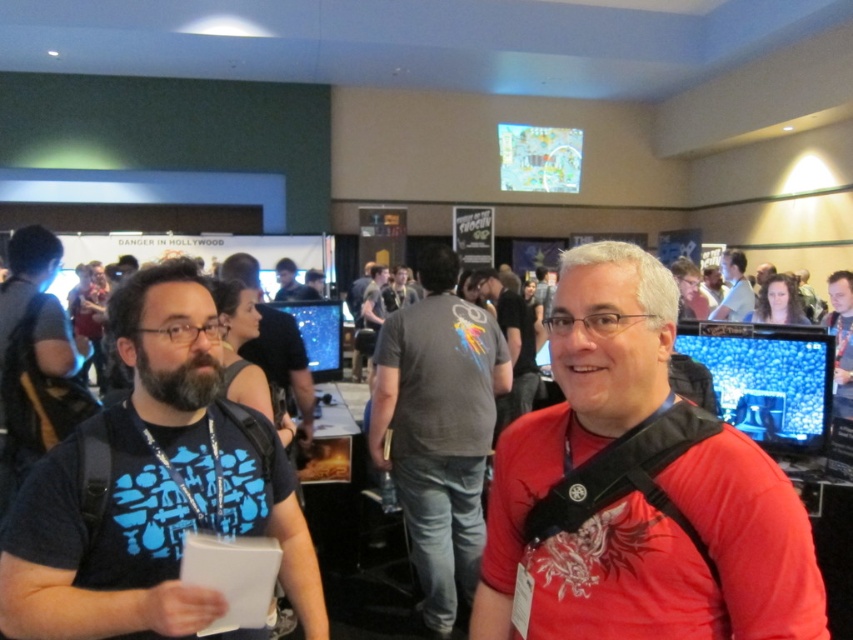
Question: Which point is farther to the camera?

Choices:
 (A) gray cotton t-shirt at center
 (B) matte gray shirt at center

Answer: (B)

Question: Is blue printed t-shirt at center bigger than gray cotton t-shirt at center?

Choices:
 (A) yes
 (B) no

Answer: (B)

Question: Estimate the real-world distances between objects in this image. Which object is closer to the gray fabric shirt at center?

Choices:
 (A) blue printed t-shirt at center
 (B) red matte shirt at center
 (C) gray cotton t-shirt at center
 (D) matte black shirt at center

Answer: (D)

Question: Does red matte shirt at center appear under blue printed t-shirt at center?

Choices:
 (A) no
 (B) yes

Answer: (A)

Question: Which object is positioned farthest from the gray fabric shirt at center?

Choices:
 (A) blue printed t-shirt at center
 (B) matte gray shirt at center
 (C) red matte shirt at center

Answer: (C)

Question: Does matte black shirt at center appear under gray fabric shirt at center?

Choices:
 (A) no
 (B) yes

Answer: (B)